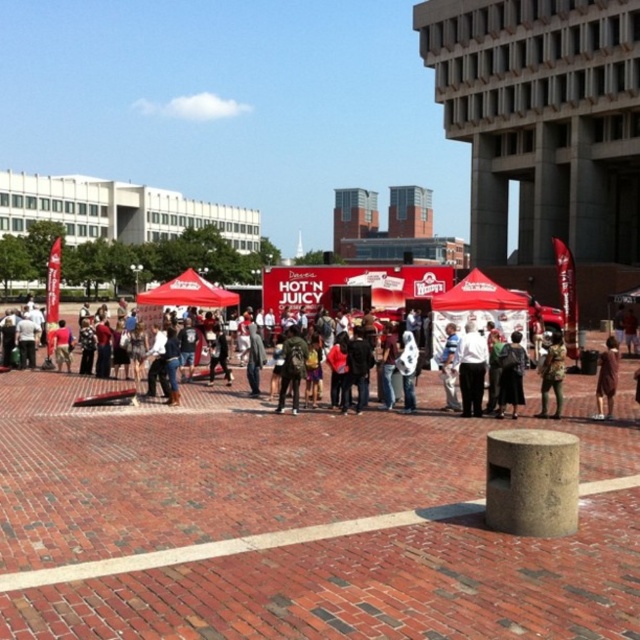
You are a participant at the event and want to retrieve your green backpack at center from under the red fabric canopy at center. Can you do so without moving the canopy?

The red fabric canopy at center is positioned over green backpack at center, so you can retrieve the green backpack at center without needing to move the canopy.

You are a food vendor at the Hot N Juicy stand. You need to reach the brown leather jacket at center to grab your jacket. The matte red canopy at center is in your way. Can you walk around it to get to the jacket?

The matte red canopy at center is further to the viewer than brown leather jacket at center, so the canopy is closer to you. To reach the jacket, you can walk around the canopy since it is in front of the jacket.